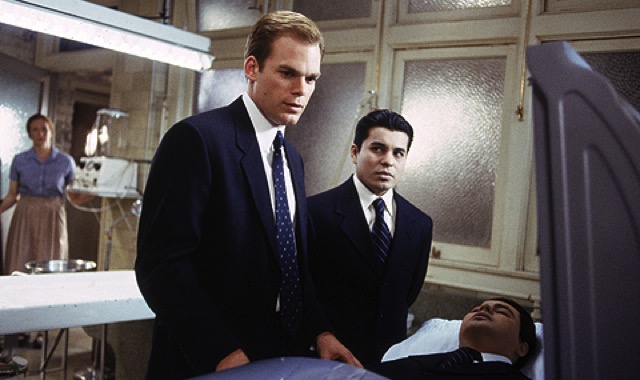
Identify the location of metal basin. point(67,265).